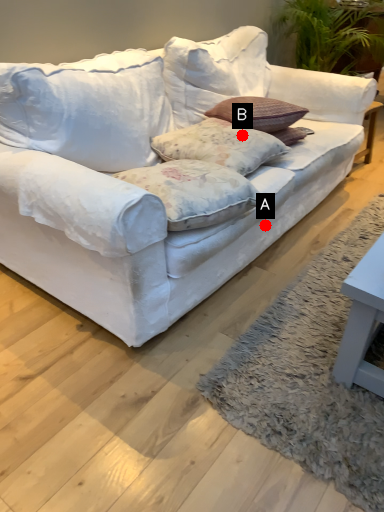
Question: Two points are circled on the image, labeled by A and B beside each circle. Which point appears closest to the camera in this image?

Choices:
 (A) A is closer
 (B) B is closer

Answer: (B)